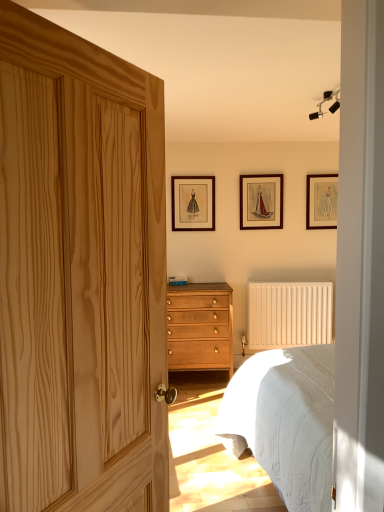
Question: Is wooden picture frame at center, which is the second picture frame in right-to-left order, facing towards white textured bed at lower right?

Choices:
 (A) no
 (B) yes

Answer: (A)

Question: Is wooden picture frame at center, the second picture frame when ordered from left to right, looking in the opposite direction of white textured bed at lower right?

Choices:
 (A) no
 (B) yes

Answer: (A)

Question: Is the depth of wooden picture frame at center, which is the second picture frame in right-to-left order, greater than that of white textured bed at lower right?

Choices:
 (A) no
 (B) yes

Answer: (B)

Question: Does wooden picture frame at center, the second picture frame when ordered from left to right, appear on the left side of white textured bed at lower right?

Choices:
 (A) no
 (B) yes

Answer: (B)

Question: Is wooden picture frame at center, the second picture frame when ordered from left to right, closer to camera compared to white textured bed at lower right?

Choices:
 (A) yes
 (B) no

Answer: (B)

Question: Can you confirm if wooden picture frame at center, the second picture frame when ordered from left to right, is wider than white textured bed at lower right?

Choices:
 (A) yes
 (B) no

Answer: (B)

Question: Is natural wood door at left wider than wooden picture frame at upper center, which ranks as the third picture frame in right-to-left order?

Choices:
 (A) no
 (B) yes

Answer: (B)

Question: Can you confirm if natural wood door at left is positioned to the right of wooden picture frame at upper center, which ranks as the third picture frame in right-to-left order?

Choices:
 (A) yes
 (B) no

Answer: (B)

Question: Does natural wood door at left appear on the left side of wooden picture frame at upper center, which ranks as the third picture frame in right-to-left order?

Choices:
 (A) no
 (B) yes

Answer: (B)

Question: Is wooden picture frame at upper center, the first picture frame in the left-to-right sequence, inside natural wood door at left?

Choices:
 (A) yes
 (B) no

Answer: (B)

Question: Considering the relative sizes of natural wood door at left and wooden picture frame at upper center, which ranks as the third picture frame in right-to-left order, in the image provided, is natural wood door at left thinner than wooden picture frame at upper center, which ranks as the third picture frame in right-to-left order,?

Choices:
 (A) yes
 (B) no

Answer: (B)

Question: Is the surface of natural wood door at left in direct contact with wooden picture frame at upper center, the first picture frame in the left-to-right sequence?

Choices:
 (A) yes
 (B) no

Answer: (B)

Question: From the image's perspective, is wooden picture frame at upper center, which ranks as the third picture frame in right-to-left order, located beneath wooden picture frame at upper right, placed as the first picture frame when sorted from right to left?

Choices:
 (A) no
 (B) yes

Answer: (B)